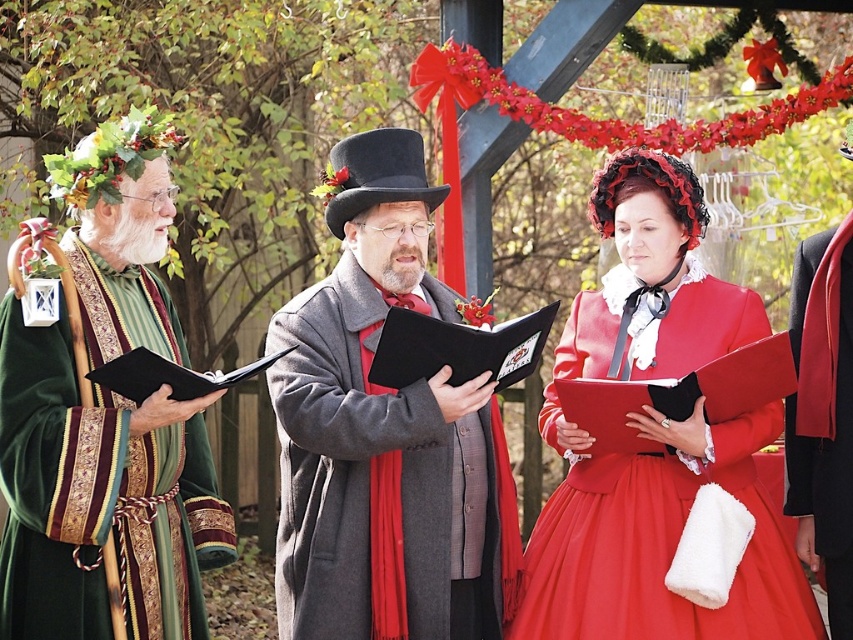
Is point (293, 540) in front of point (335, 161)?

That is True.

Locate an element on the screen. This screenshot has height=640, width=853. velvet gray coat at center is located at coordinates (384, 433).

Find the location of a particular element. matte red dress at center is located at coordinates (657, 442).

Can you confirm if matte red dress at center is thinner than black velvet robe at right?

No.

At what (x,y) coordinates should I click in order to perform the action: click on matte red dress at center. Please return your answer as a coordinate pair (x, y). Looking at the image, I should click on (657, 442).

Is point (50, 532) behind point (807, 628)?

No, (50, 532) is closer to viewer.

Who is more forward, (7, 499) or (631, 592)?

Point (7, 499)

Find the location of `velvet green robe at left`. velvet green robe at left is located at coordinates (105, 420).